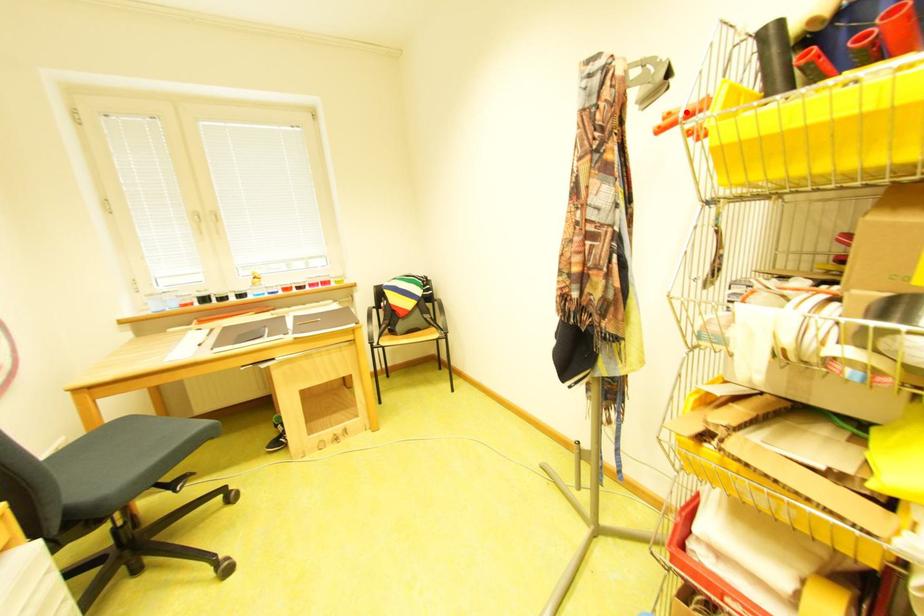
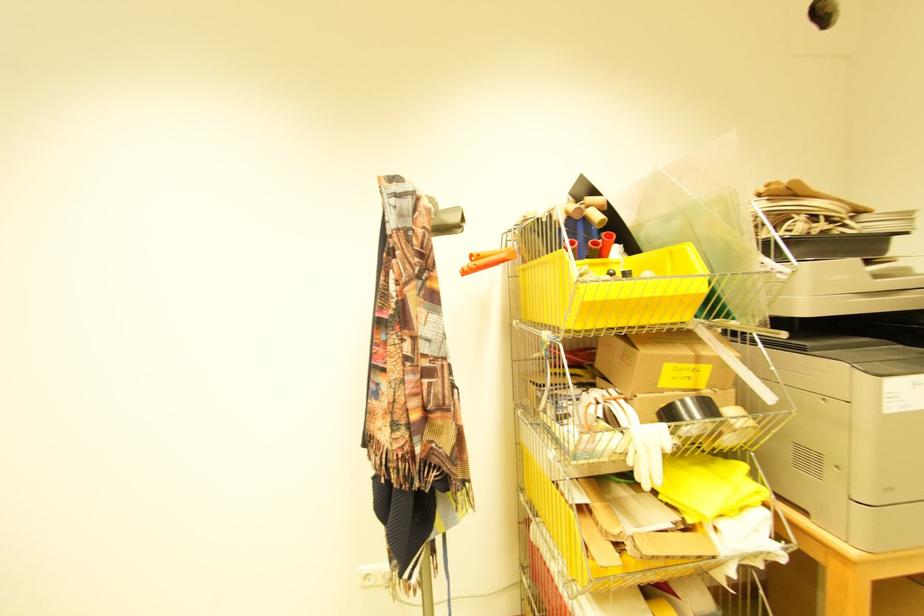
Locate, in the second image, the point that corresponds to the highlighted location in the first image.

(492, 254)